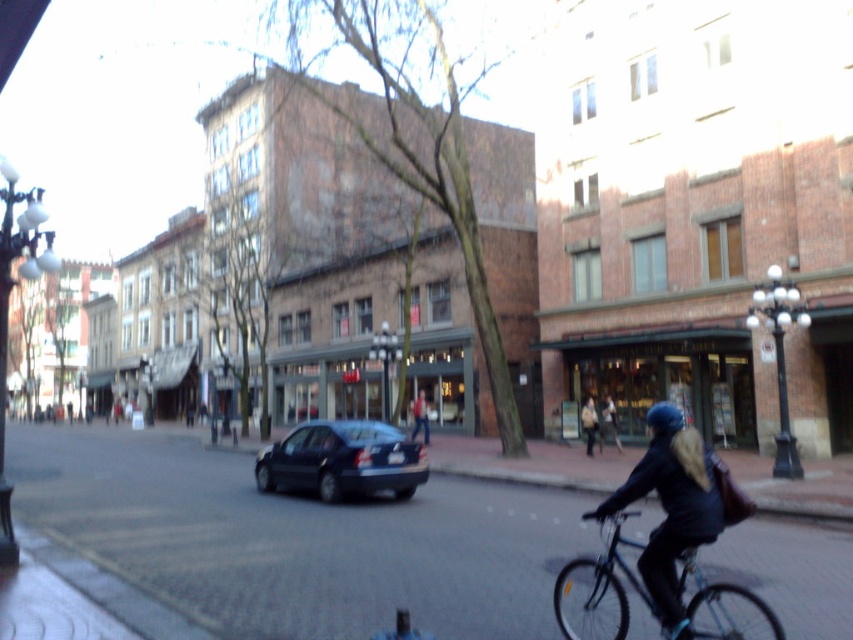
Between dark blue helmet at center and shiny dark blue sedan at center, which one has less height?

Standing shorter between the two is dark blue helmet at center.

Is point (659, 442) farther from viewer compared to point (363, 458)?

No, it is in front of (363, 458).

Find the location of a particular element. The height and width of the screenshot is (640, 853). dark blue helmet at center is located at coordinates (671, 506).

Between point (585, 557) and point (590, 403), which one is positioned behind?

Positioned behind is point (590, 403).

Can you confirm if blue metallic bicycle at lower right is wider than dark blue jacket at center?

Yes.

Which is behind, point (598, 573) or point (585, 432)?

The point (585, 432) is behind.

Locate an element on the screen. blue metallic bicycle at lower right is located at coordinates [604, 579].

Who is shorter, dark blue helmet at center or dark blue jacket at center?

A: With less height is dark blue jacket at center.

Which is more to the left, dark blue helmet at center or dark blue jacket at center?

From the viewer's perspective, dark blue helmet at center appears more on the left side.

In order to click on dark blue helmet at center in this screenshot , I will do `click(671, 506)`.

Locate an element on the screen. This screenshot has width=853, height=640. dark blue helmet at center is located at coordinates (671, 506).